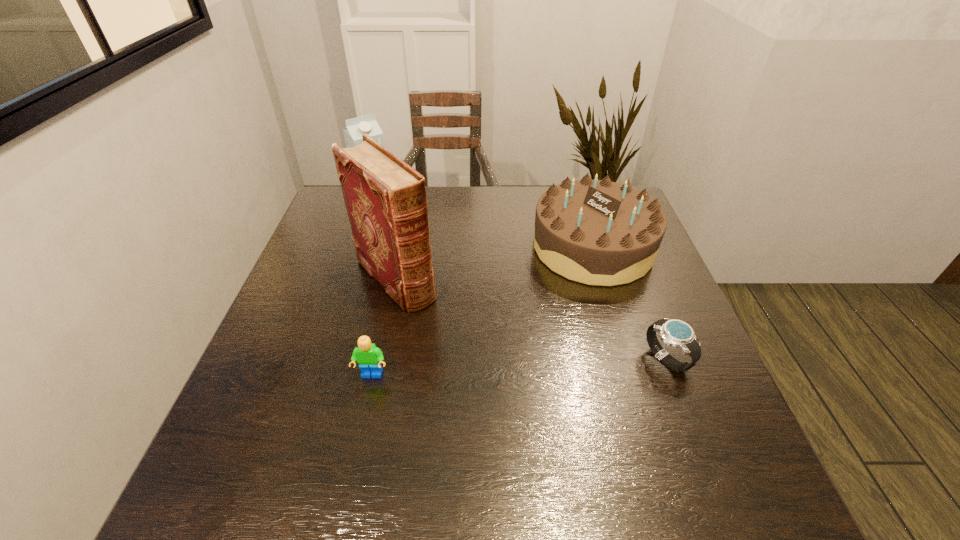
Locate an element on the screen. This screenshot has height=540, width=960. Lego is located at coordinates click(x=369, y=357).

The width and height of the screenshot is (960, 540). Find the location of `the shortest object`. the shortest object is located at coordinates (676, 333).

Locate an element on the screen. the tallest object is located at coordinates (385, 198).

Locate an element on the screen. The image size is (960, 540). the fourth shortest object is located at coordinates (356, 127).

Locate an element on the screen. This screenshot has height=540, width=960. the third shortest object is located at coordinates (596, 232).

This screenshot has height=540, width=960. I want to click on free location located on the face of the Lego, so coord(364,413).

In order to click on vacant region located on the front of the shortest object in this screenshot , I will do `click(697, 440)`.

You are a GUI agent. You are given a task and a screenshot of the screen. Output one action in this format:
    pyautogui.click(x=<x>, y=<y>)
    Task: Click on the vacant space located 0.130m on the spine side of the tallest object
    
    Given the screenshot: What is the action you would take?
    pyautogui.click(x=449, y=338)

Identify the location of free space located 0.370m on the spine side of the tallest object. (522, 414).

Find the location of a particular element. free spot located on the spine side of the tallest object is located at coordinates (490, 380).